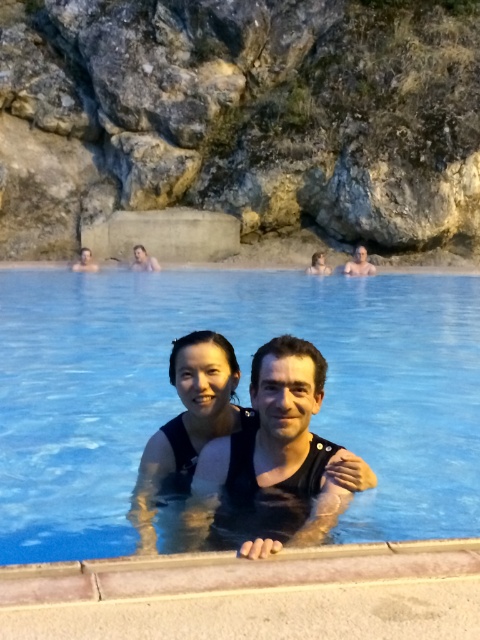
Is black matte swimsuit at center below matte black man at upper left?

Indeed, black matte swimsuit at center is positioned under matte black man at upper left.

From the picture: Is black matte swimsuit at center shorter than matte black man at upper left?

In fact, black matte swimsuit at center may be taller than matte black man at upper left.

Is point (311, 480) positioned in front of point (88, 252)?

Yes.

I want to click on black matte swimsuit at center, so click(x=277, y=449).

Between matte black swimsuit at center and matte black man at upper left, which one is positioned lower?

Positioned lower is matte black swimsuit at center.

Consider the image. Does matte black swimsuit at center lie in front of matte black man at upper left?

That is True.

This screenshot has width=480, height=640. What are the coordinates of `matte black swimsuit at center` in the screenshot? It's located at (188, 424).

Locate an element on the screen. This screenshot has width=480, height=640. matte black swimsuit at center is located at coordinates coord(188,424).

Is clear blue water at center to the left of matte black man at upper left from the viewer's perspective?

In fact, clear blue water at center is to the right of matte black man at upper left.

Which of these two, clear blue water at center or matte black man at upper left, stands taller?

clear blue water at center

What do you see at coordinates (245, 365) in the screenshot? I see `clear blue water at center` at bounding box center [245, 365].

Where is `clear blue water at center`? This screenshot has height=640, width=480. clear blue water at center is located at coordinates 245,365.